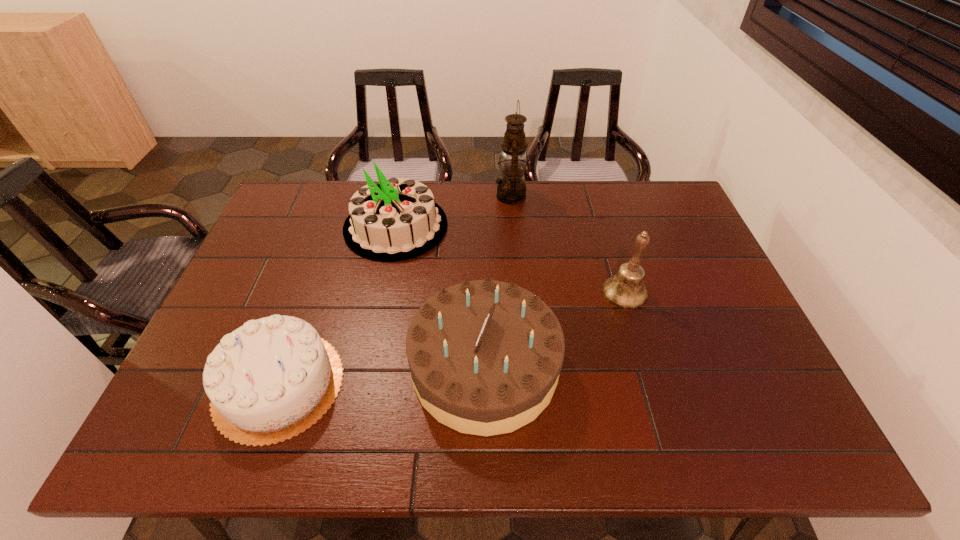
Where is `vacant space that's between the bell and the oil lamp`? This screenshot has height=540, width=960. vacant space that's between the bell and the oil lamp is located at coordinates (567, 244).

Identify the location of object that is the closest one to the tallest birthday cake. (511, 189).

Identify which object is the third nearest to the farthest birthday cake. Please provide its 2D coordinates. Your answer should be formatted as a tuple, i.e. [(x, y)], where the tuple contains the x and y coordinates of a point satisfying the conditions above.

[(269, 380)]

Where is `birthday cake that is the third closest to the rightmost object`? The width and height of the screenshot is (960, 540). birthday cake that is the third closest to the rightmost object is located at coordinates (269, 380).

Identify which birthday cake is located as the third nearest to the tallest object. Please provide its 2D coordinates. Your answer should be formatted as a tuple, i.e. [(x, y)], where the tuple contains the x and y coordinates of a point satisfying the conditions above.

[(269, 380)]

Identify the location of vacant space that satisfies the following two spatial constraints: 1. on the front side of the third farthest object; 2. on the right side of the tallest object. (518, 292).